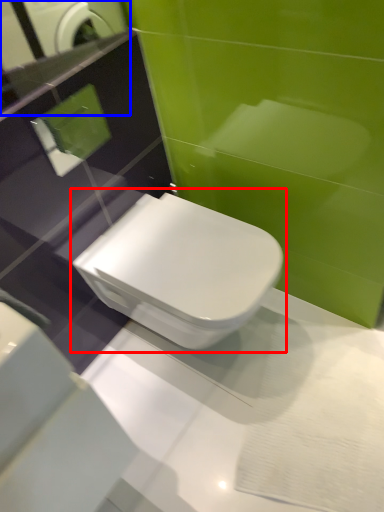
Question: Which object is closer to the camera taking this photo, toilet (highlighted by a red box) or mirror (highlighted by a blue box)?

Choices:
 (A) toilet
 (B) mirror

Answer: (B)